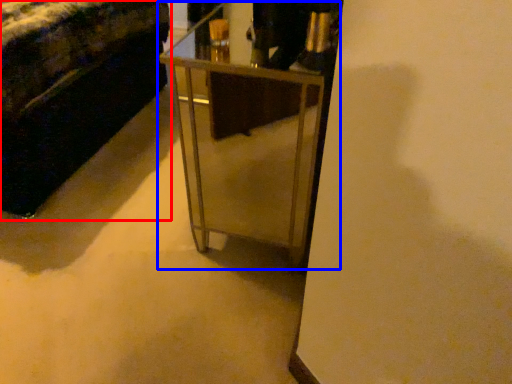
Question: Which point is further to the camera, furniture (highlighted by a red box) or table (highlighted by a blue box)?

Choices:
 (A) furniture
 (B) table

Answer: (A)